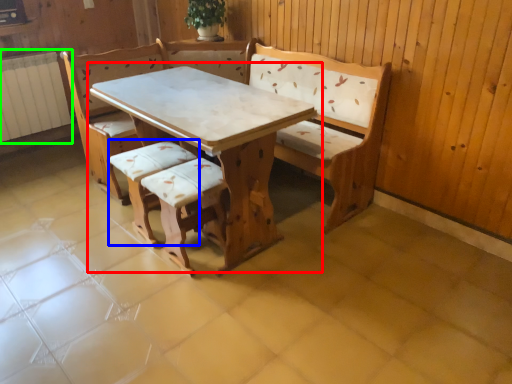
Question: Estimate the real-world distances between objects in this image. Which object is closer to table (highlighted by a red box), armchair (highlighted by a blue box) or radiator (highlighted by a green box)?

Choices:
 (A) armchair
 (B) radiator

Answer: (A)